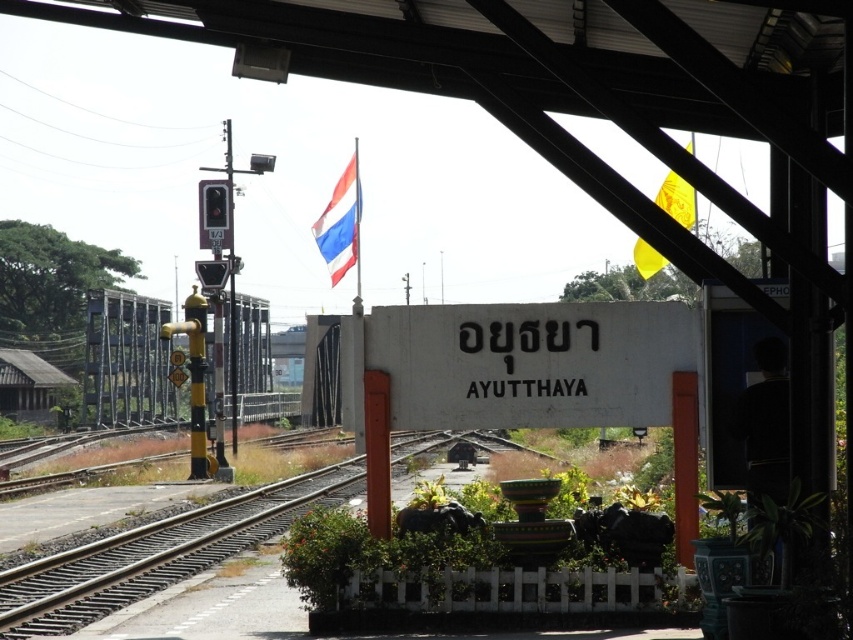
Which is above, polished fabric flag at upper center or yellow fabric flag at upper right?

polished fabric flag at upper center

Between point (325, 252) and point (686, 193), which one is positioned behind?

The point (325, 252) is behind.

Identify the location of polished fabric flag at upper center. Image resolution: width=853 pixels, height=640 pixels. (340, 225).